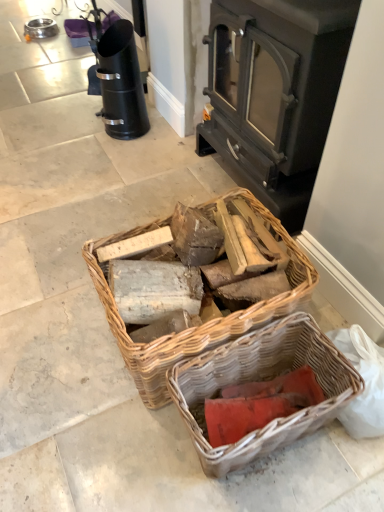
What are the coordinates of `vacant space to the left of woven wood basket at center, the first picnic basket viewed from the top` in the screenshot? It's located at (56, 339).